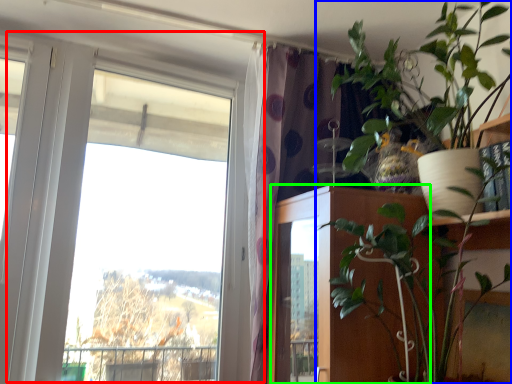
Question: Which object is the farthest from window (highlighted by a red box)? Choose among these: houseplant (highlighted by a blue box) or door (highlighted by a green box).

Choices:
 (A) houseplant
 (B) door

Answer: (A)